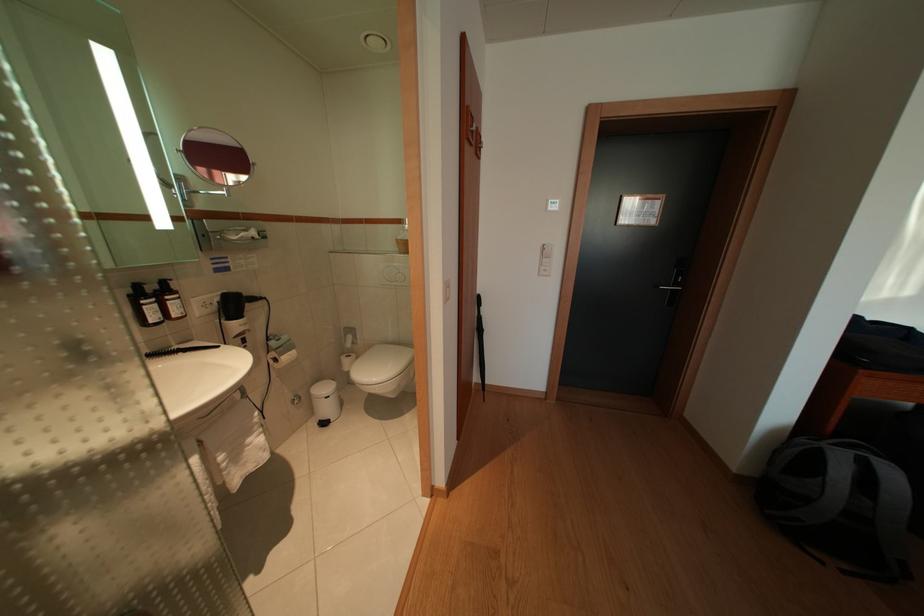
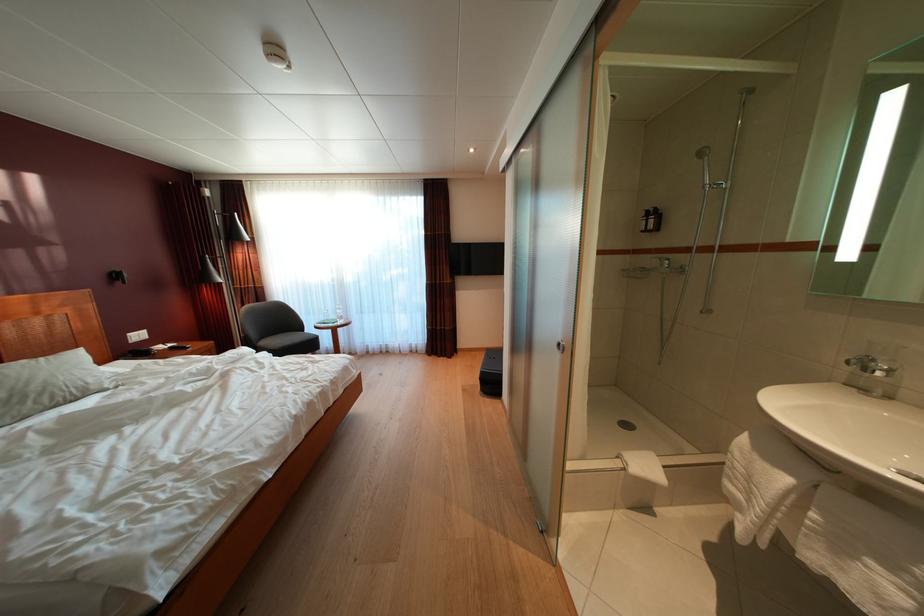
The point at (245, 461) is marked in the first image. Where is the corresponding point in the second image?

(849, 554)